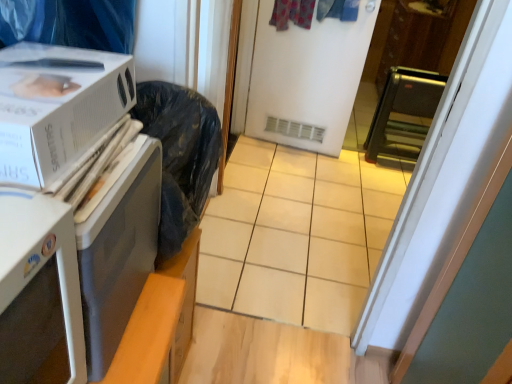
Question: Can you confirm if black metallic toaster oven at right, which ranks as the 2th appliance in front-to-back order, is positioned to the right of white plastic microwave at left, the first appliance ordered from the bottom?

Choices:
 (A) no
 (B) yes

Answer: (B)

Question: Would you consider black metallic toaster oven at right, the 2th appliance in the bottom-to-top sequence, to be distant from white plastic microwave at left, the first appliance ordered from the bottom?

Choices:
 (A) no
 (B) yes

Answer: (B)

Question: Does black metallic toaster oven at right, the 2th appliance in the bottom-to-top sequence, have a greater height compared to white plastic microwave at left, the 2th appliance positioned from the back?

Choices:
 (A) no
 (B) yes

Answer: (B)

Question: From the image's perspective, would you say black metallic toaster oven at right, the 1th appliance from the top, is shown under white plastic microwave at left, the first appliance ordered from the bottom?

Choices:
 (A) yes
 (B) no

Answer: (B)

Question: Is black metallic toaster oven at right, the 2th appliance in the bottom-to-top sequence, completely or partially outside of white plastic microwave at left, the first appliance ordered from the bottom?

Choices:
 (A) yes
 (B) no

Answer: (A)

Question: Is black metallic toaster oven at right, the second appliance from the left, situated inside white cardboard box at left or outside?

Choices:
 (A) outside
 (B) inside

Answer: (A)

Question: From the image's perspective, relative to white cardboard box at left, is black metallic toaster oven at right, the second appliance from the left, above or below?

Choices:
 (A) above
 (B) below

Answer: (A)

Question: Does point (392, 71) appear closer or farther from the camera than point (88, 87)?

Choices:
 (A) farther
 (B) closer

Answer: (A)

Question: Is black metallic toaster oven at right, the first appliance in the right-to-left sequence, taller or shorter than white cardboard box at left?

Choices:
 (A) tall
 (B) short

Answer: (A)

Question: From a real-world perspective, relative to black metallic toaster oven at right, marked as the first appliance in a back-to-front arrangement, is white plastic microwave at left, the 2th appliance positioned from the back, vertically above or below?

Choices:
 (A) above
 (B) below

Answer: (A)

Question: Relative to black metallic toaster oven at right, which ranks as the 2th appliance in front-to-back order, is white plastic microwave at left, the second appliance viewed from the right, in front or behind?

Choices:
 (A) front
 (B) behind

Answer: (A)

Question: Based on their positions, is white plastic microwave at left, the 2th appliance positioned from the back, located to the left or right of black metallic toaster oven at right, which ranks as the 2th appliance in front-to-back order?

Choices:
 (A) left
 (B) right

Answer: (A)

Question: From the image's perspective, is white plastic microwave at left, the first appliance ordered from the bottom, positioned above or below black metallic toaster oven at right, the first appliance in the right-to-left sequence?

Choices:
 (A) below
 (B) above

Answer: (A)

Question: In the image, is white plastic microwave at left, the first appliance ordered from the bottom, on the left side or the right side of white matte screen door at center?

Choices:
 (A) left
 (B) right

Answer: (A)

Question: From the image's perspective, is white plastic microwave at left, the 2th appliance when ordered from top to bottom, positioned above or below white matte screen door at center?

Choices:
 (A) above
 (B) below

Answer: (B)